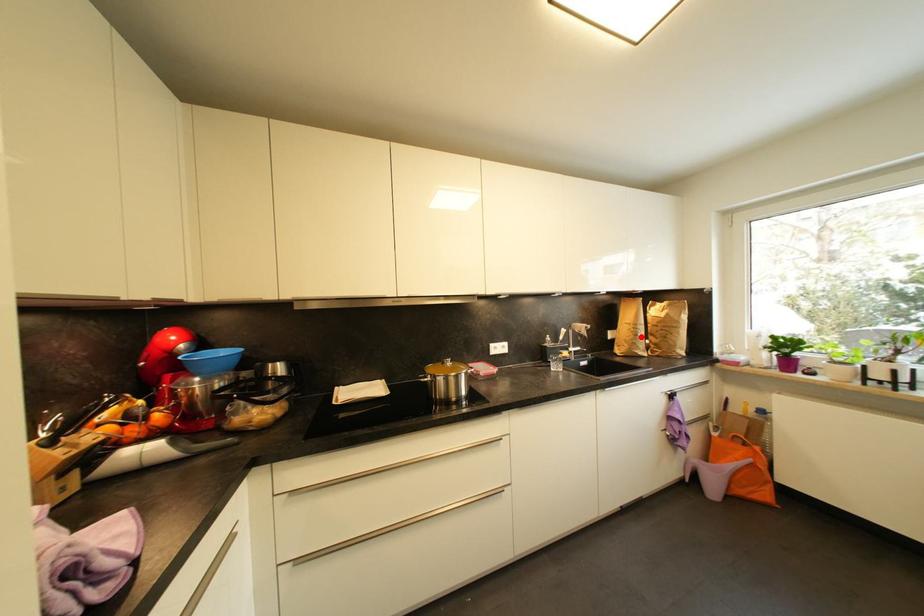
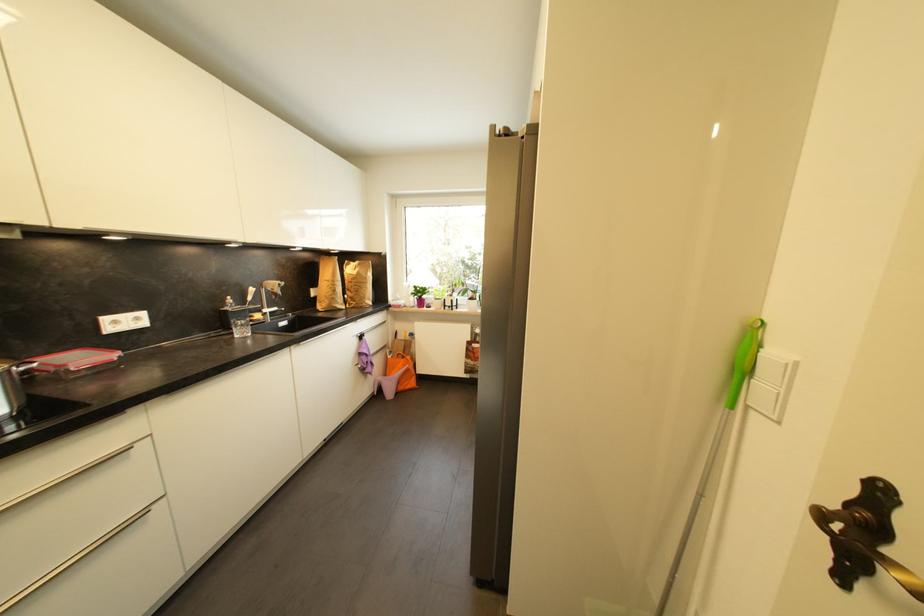
Question: I am providing you with two images of the same scene from different viewpoints. Given a red point in image1, look at the same physical point in image2. Is it:

Choices:
 (A) Closer to the viewpoint
 (B) Farther from the viewpoint

Answer: (A)